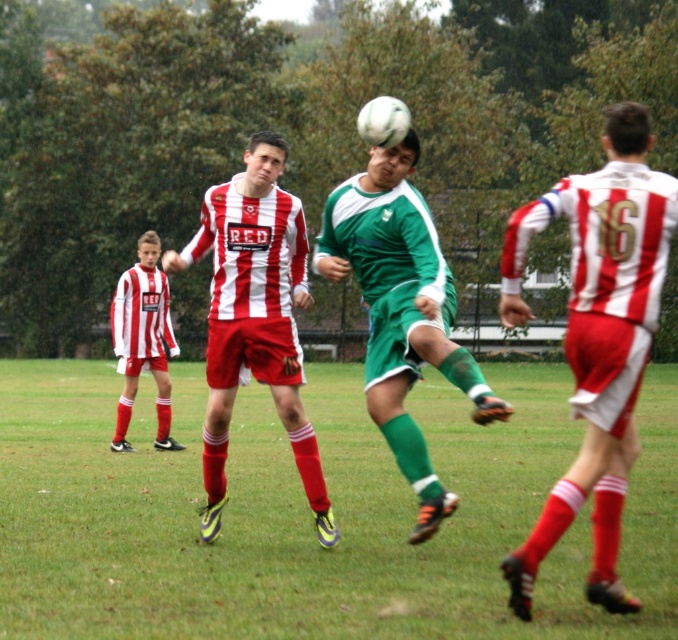
Question: Which object appears closest to the camera in this image?

Choices:
 (A) striped jersey at right
 (B) white matte soccer ball at center
 (C) green matte soccer ball at center

Answer: (B)

Question: Based on their relative distances, which object is farther from the green matte soccer ball at center?

Choices:
 (A) matte red and white striped jersey at center
 (B) matte red and white jersey at left
 (C) green grass at center

Answer: (C)

Question: Is white matte soccer ball at center behind matte red and white jersey at left?

Choices:
 (A) yes
 (B) no

Answer: (B)

Question: Observing the image, what is the correct spatial positioning of green matte soccer ball at center in reference to matte red and white jersey at left?

Choices:
 (A) above
 (B) below

Answer: (B)

Question: In this image, where is green grass at center located relative to striped jersey at right?

Choices:
 (A) left
 (B) right

Answer: (A)

Question: Which point is farther to the camera?

Choices:
 (A) (626, 634)
 (B) (597, 323)
 (C) (410, 228)
 (D) (144, 275)

Answer: (D)